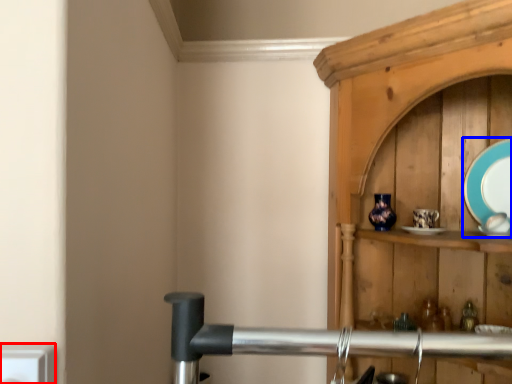
Question: Among these objects, which one is farthest to the camera, electric outlet (highlighted by a red box) or platter (highlighted by a blue box)?

Choices:
 (A) electric outlet
 (B) platter

Answer: (B)